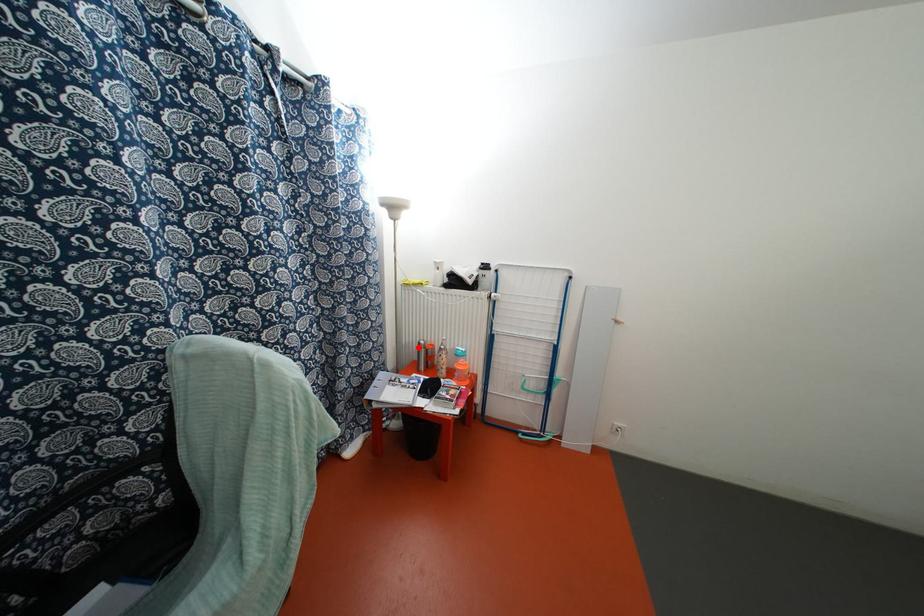
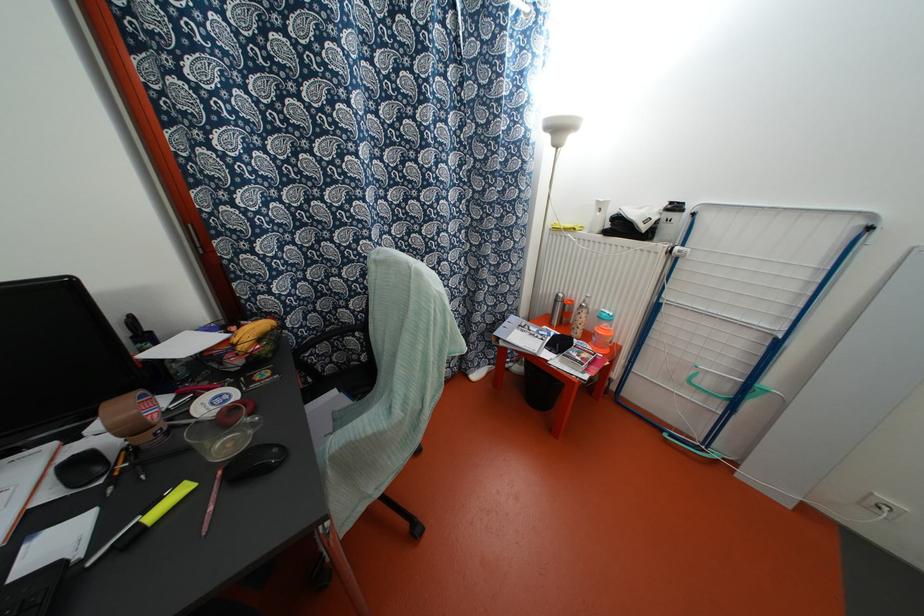
In the second image, find the point that corresponds to the highlighted location in the first image.

(554, 301)